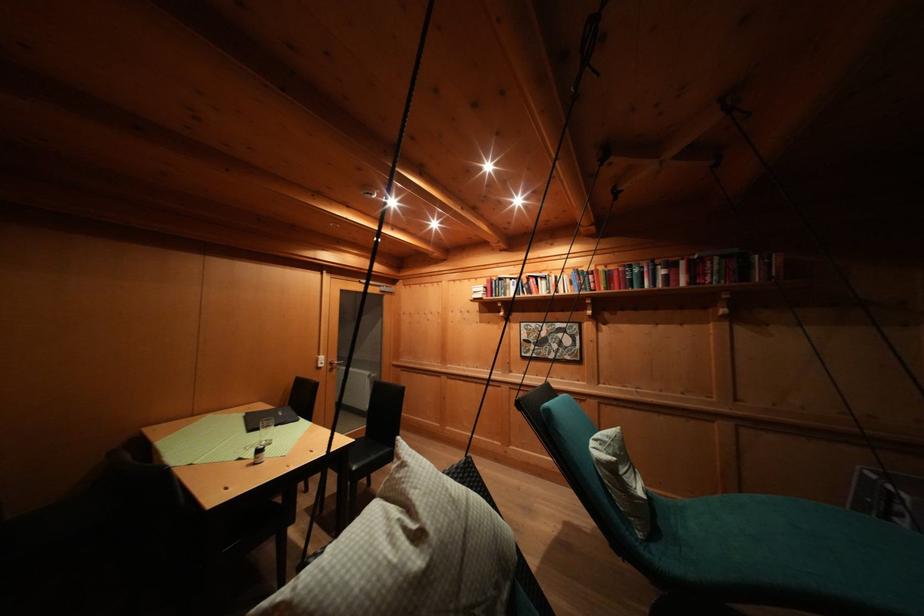
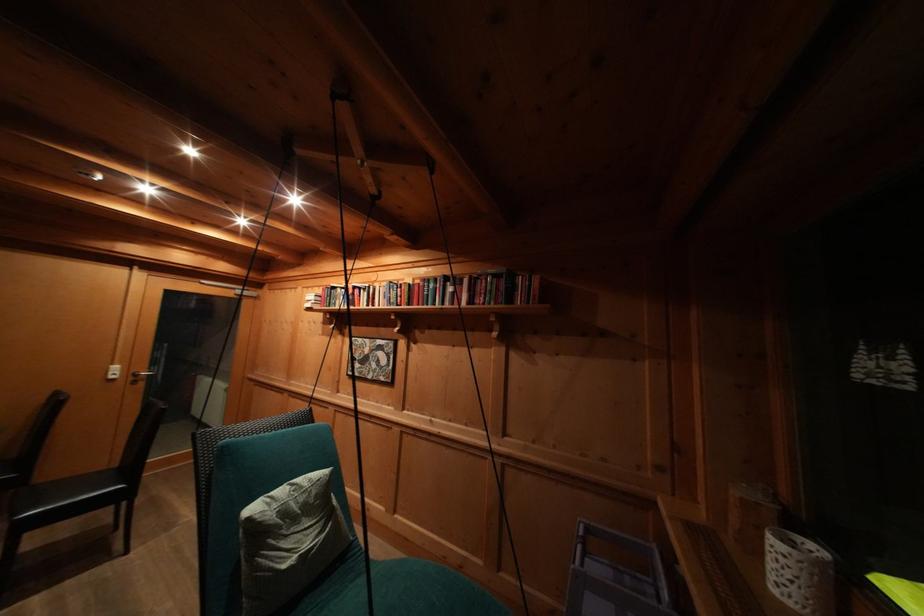
In the second image, find the point that corresponds to (602,445) in the first image.

(298, 490)